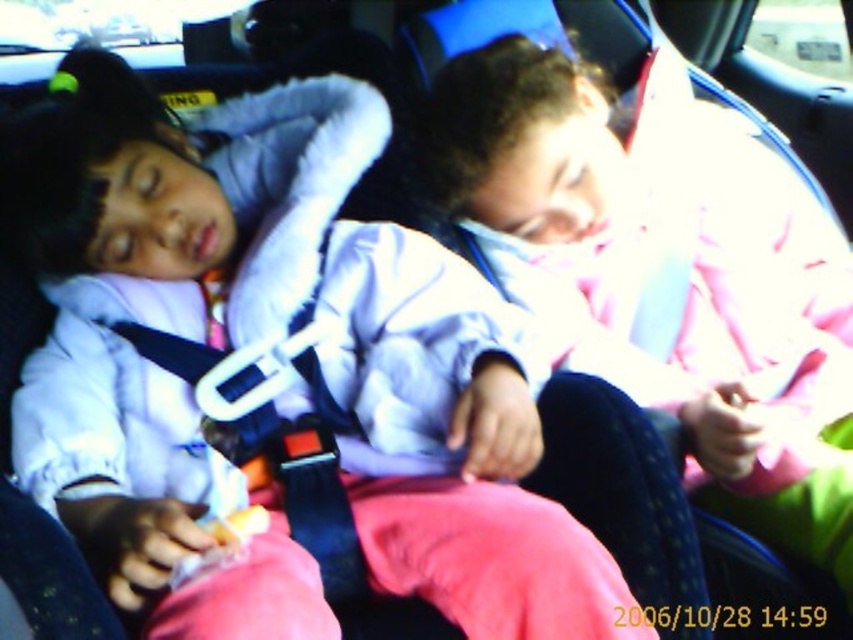
Is white matte shirt at center bigger than pink fabric at center?

Yes, white matte shirt at center is bigger than pink fabric at center.

Is white matte shirt at center smaller than pink fabric at center?

Incorrect, white matte shirt at center is not smaller in size than pink fabric at center.

Between point (67, 192) and point (724, 308), which one is positioned in front?

Point (67, 192) is in front.

At what (x,y) coordinates should I click in order to perform the action: click on white matte shirt at center. Please return your answer as a coordinate pair (x, y). The width and height of the screenshot is (853, 640). Looking at the image, I should click on (142, 356).